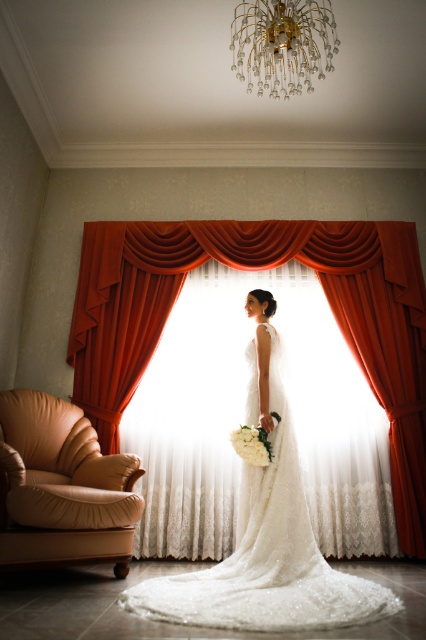
Can you confirm if matte orange curtain at center is taller than tan leather armchair at lower left?

Correct, matte orange curtain at center is much taller as tan leather armchair at lower left.

Can you confirm if matte orange curtain at center is wider than tan leather armchair at lower left?

Indeed, matte orange curtain at center has a greater width compared to tan leather armchair at lower left.

Locate an element on the screen. The height and width of the screenshot is (640, 426). matte orange curtain at center is located at coordinates (261, 268).

Between point (169, 248) and point (253, 436), which one is positioned in front?

Positioned in front is point (253, 436).

Between point (412, 284) and point (268, 454), which one is positioned in front?

Point (268, 454) is more forward.

This screenshot has height=640, width=426. Identify the location of matte orange curtain at center. (261, 268).

Is tan leather armchair at lower left to the left of gold crystal chandelier at upper center from the viewer's perspective?

Correct, you'll find tan leather armchair at lower left to the left of gold crystal chandelier at upper center.

Can you confirm if tan leather armchair at lower left is thinner than gold crystal chandelier at upper center?

No.

The height and width of the screenshot is (640, 426). I want to click on tan leather armchair at lower left, so click(62, 486).